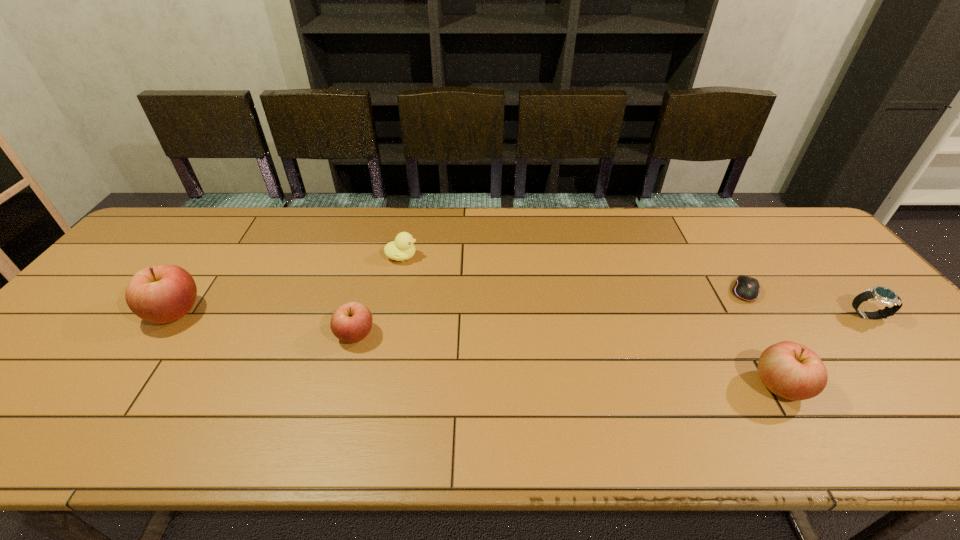
Identify the location of free space that is in between the duckling and the leftmost apple. (288, 285).

Locate an element on the screen. object that stands as the fifth closest to the shortest apple is located at coordinates (883, 295).

The height and width of the screenshot is (540, 960). Find the location of `object that ranks as the second closest to the duckling`. object that ranks as the second closest to the duckling is located at coordinates (161, 294).

You are a GUI agent. You are given a task and a screenshot of the screen. Output one action in this format:
    pyautogui.click(x=<x>, y=<y>)
    Task: Click on the apple that is the third closest one to the farthest object
    The image size is (960, 540).
    Given the screenshot: What is the action you would take?
    pyautogui.click(x=790, y=370)

Locate which apple ranks in proximity to the second apple from right to left. Please provide its 2D coordinates. Your answer should be formatted as a tuple, i.e. [(x, y)], where the tuple contains the x and y coordinates of a point satisfying the conditions above.

[(161, 294)]

Where is `free space that satisfies the following two spatial constraints: 1. at the beak of the rightmost apple; 2. on the right side of the farthest object`? The image size is (960, 540). free space that satisfies the following two spatial constraints: 1. at the beak of the rightmost apple; 2. on the right side of the farthest object is located at coordinates (375, 386).

Locate an element on the screen. free space that satisfies the following two spatial constraints: 1. at the beak of the duckling; 2. on the left side of the rightmost object is located at coordinates (390, 316).

The width and height of the screenshot is (960, 540). I want to click on vacant space that satisfies the following two spatial constraints: 1. on the back side of the rightmost object; 2. at the beak of the duckling, so (x=815, y=256).

Where is `free spot that satisfies the following two spatial constraints: 1. on the back side of the shortest apple; 2. on the left side of the rightmost object`? The image size is (960, 540). free spot that satisfies the following two spatial constraints: 1. on the back side of the shortest apple; 2. on the left side of the rightmost object is located at coordinates (360, 316).